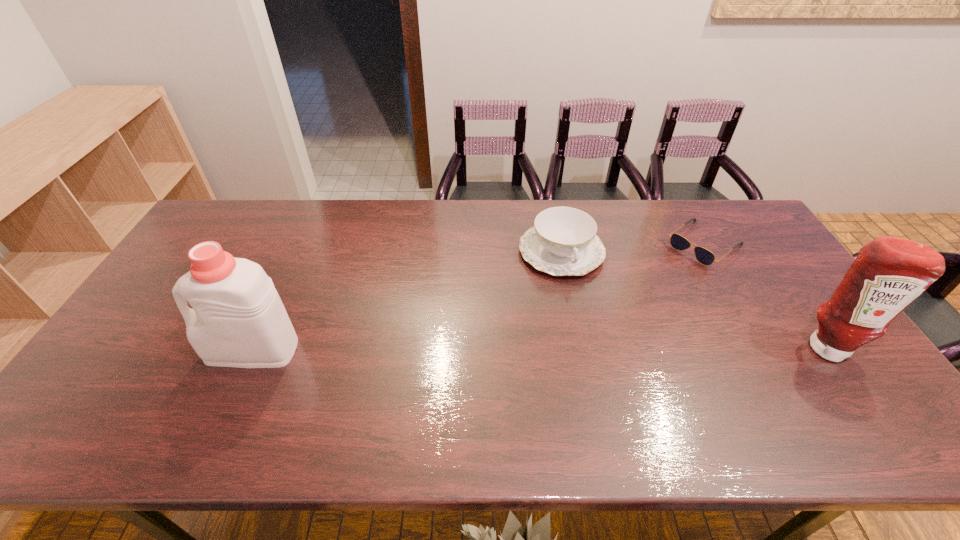
The image size is (960, 540). Find the location of `free location located on the handle side of the chinaware`. free location located on the handle side of the chinaware is located at coordinates (600, 347).

Identify the location of free space located 0.120m on the handle side of the chinaware. (585, 310).

At what (x,y) coordinates should I click in order to perform the action: click on vacant point located on the front-facing side of the sunglasses. Please return your answer as a coordinate pair (x, y). Looking at the image, I should click on (644, 291).

I want to click on vacant area situated 0.370m on the front-facing side of the sunglasses, so click(611, 317).

The image size is (960, 540). What are the coordinates of `free space located 0.250m on the front-facing side of the sunglasses` in the screenshot? It's located at (636, 297).

Find the location of a particular element. chinaware present at the far edge is located at coordinates (563, 241).

At what (x,y) coordinates should I click in order to perform the action: click on sunglasses that is at the far edge. Please return your answer as a coordinate pair (x, y). The height and width of the screenshot is (540, 960). Looking at the image, I should click on (705, 257).

You are a GUI agent. You are given a task and a screenshot of the screen. Output one action in this format:
    pyautogui.click(x=<x>, y=<y>)
    Task: Click on the condiment that is at the right edge
    Image resolution: width=960 pixels, height=540 pixels.
    Given the screenshot: What is the action you would take?
    pyautogui.click(x=889, y=273)

Where is `sunglasses situated at the right edge`? The width and height of the screenshot is (960, 540). sunglasses situated at the right edge is located at coordinates 705,257.

At what (x,y) coordinates should I click in order to perform the action: click on object present at the far right corner. Please return your answer as a coordinate pair (x, y). The height and width of the screenshot is (540, 960). Looking at the image, I should click on pyautogui.click(x=705, y=257).